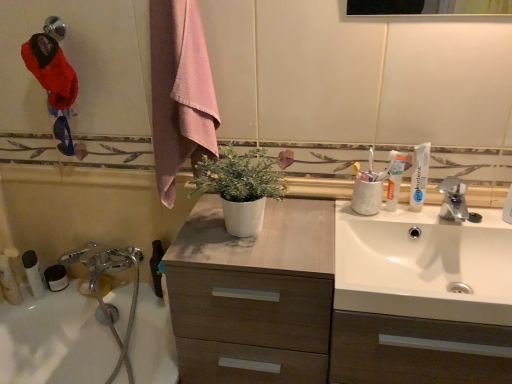
Identify the location of free space to the left of white matte tube of toothpaste at upper right, positioned as the third toothpaste in left-to-right order. This screenshot has height=384, width=512. (362, 223).